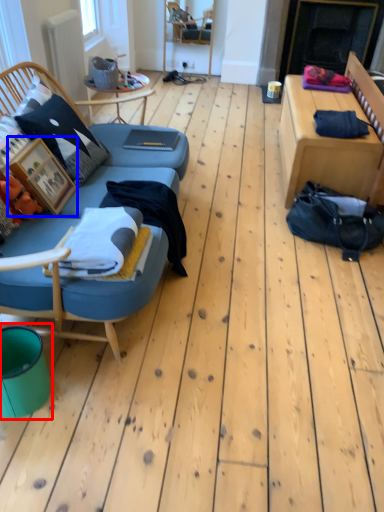
Question: Which object is further to the camera taking this photo, teal (highlighted by a red box) or picture frame (highlighted by a blue box)?

Choices:
 (A) teal
 (B) picture frame

Answer: (B)